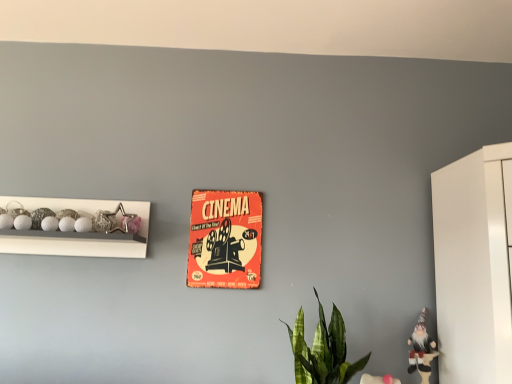
Question: From a real-world perspective, is orange paper poster at center located beneath green leafy plant at lower center?

Choices:
 (A) no
 (B) yes

Answer: (A)

Question: Is orange paper poster at center outside green leafy plant at lower center?

Choices:
 (A) no
 (B) yes

Answer: (B)

Question: Is orange paper poster at center surrounding green leafy plant at lower center?

Choices:
 (A) yes
 (B) no

Answer: (B)

Question: Is orange paper poster at center shorter than green leafy plant at lower center?

Choices:
 (A) yes
 (B) no

Answer: (B)

Question: From the image's perspective, would you say orange paper poster at center is positioned over green leafy plant at lower center?

Choices:
 (A) no
 (B) yes

Answer: (B)

Question: Is metallic star at left, which is the second toy in bottom-to-top order, in front of or behind white fabric gnome at lower right, arranged as the 2th toy when viewed from the top, in the image?

Choices:
 (A) behind
 (B) front

Answer: (A)

Question: From a real-world perspective, is metallic star at left, which is the second toy in bottom-to-top order, positioned above or below white fabric gnome at lower right, which appears as the first toy when viewed from the right?

Choices:
 (A) above
 (B) below

Answer: (A)

Question: Is point (119, 208) closer or farther from the camera than point (421, 345)?

Choices:
 (A) farther
 (B) closer

Answer: (A)

Question: From the image's perspective, relative to white fabric gnome at lower right, which appears as the 1th toy when ordered from the bottom, is metallic star at left, which appears as the first toy when viewed from the left, above or below?

Choices:
 (A) below
 (B) above

Answer: (B)

Question: Relative to white fabric gnome at lower right, arranged as the 2th toy when viewed from the top, is orange paper poster at center in front or behind?

Choices:
 (A) front
 (B) behind

Answer: (B)

Question: From a real-world perspective, is orange paper poster at center positioned above or below white fabric gnome at lower right, which appears as the 1th toy when ordered from the bottom?

Choices:
 (A) below
 (B) above

Answer: (B)

Question: From the image's perspective, is orange paper poster at center located above or below white fabric gnome at lower right, which appears as the first toy when viewed from the right?

Choices:
 (A) above
 (B) below

Answer: (A)

Question: From their relative heights in the image, would you say orange paper poster at center is taller or shorter than white fabric gnome at lower right, which appears as the 1th toy when ordered from the bottom?

Choices:
 (A) short
 (B) tall

Answer: (B)

Question: Considering the positions of point click(113, 251) and point click(420, 317), is point click(113, 251) closer or farther from the camera than point click(420, 317)?

Choices:
 (A) closer
 (B) farther

Answer: (A)

Question: Relative to white fabric gnome at lower right, the second toy from the left, is white glossy beads at left in front or behind?

Choices:
 (A) behind
 (B) front

Answer: (A)